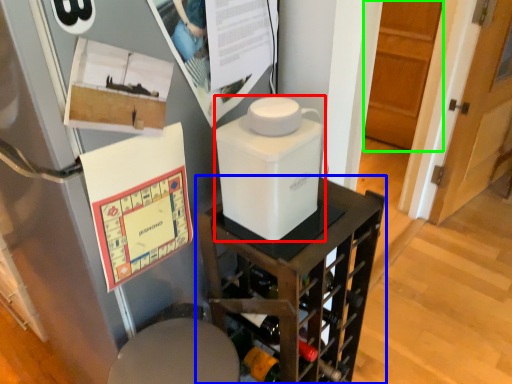
Question: Which object is the farthest from appliance (highlighted by a red box)? Choose among these: furniture (highlighted by a blue box) or door (highlighted by a green box).

Choices:
 (A) furniture
 (B) door

Answer: (B)